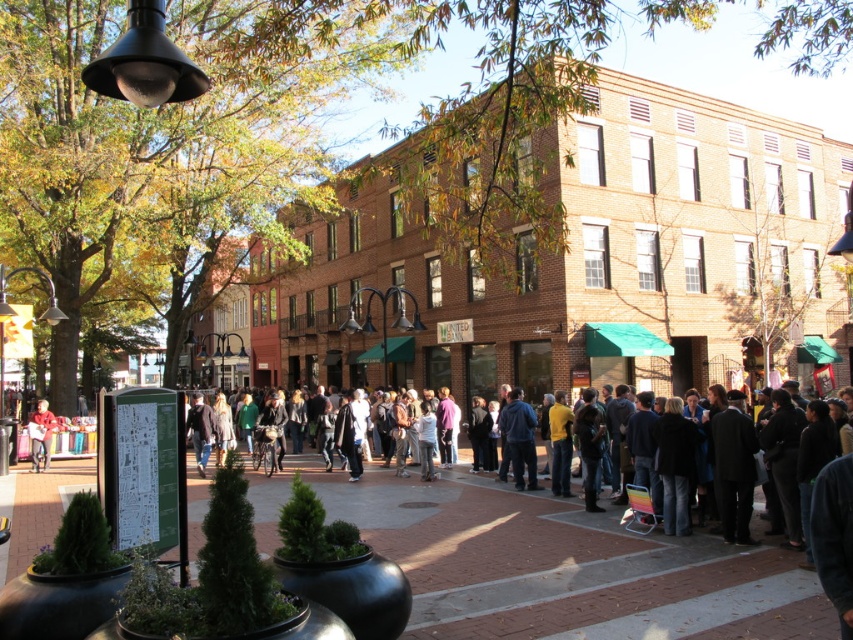
You are a delivery person who needs to place a package on the brick pavement at center. However, there is a matte black jacket at left nearby. Which object is higher in height so you can place the package there?

The brick pavement at center is taller than the matte black jacket at left, so you should place the package on the brick pavement at center.

You are standing at the point marked as point [566,566] in the image. What type of surface are you currently standing on?

You are standing on brick pavement at center.

You are standing in the plaza and want to walk from point A to point B. Point A is at coordinate point(335, 480) and point B is at coordinate point(51, 426). Which point is closer to you when you start at point A?

Point A at coordinate point(335, 480) is closer to you since it is your starting position. However, if you are asking about proximity between the two points relative to the viewer, point(335, 480) is closer to the viewer than point(51, 426).